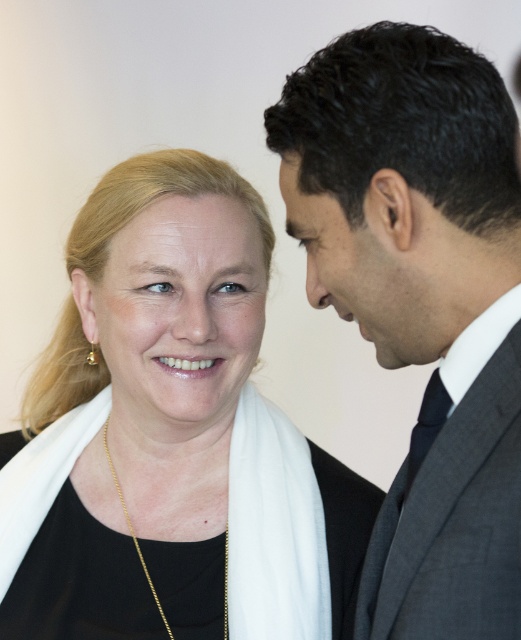
How much distance is there between dark gray suit at right and navy blue silk tie at right?

The distance of dark gray suit at right from navy blue silk tie at right is 12.80 centimeters.

Can you confirm if dark gray suit at right is positioned above navy blue silk tie at right?

Correct, dark gray suit at right is located above navy blue silk tie at right.

Image resolution: width=521 pixels, height=640 pixels. What do you see at coordinates (420, 300) in the screenshot?
I see `dark gray suit at right` at bounding box center [420, 300].

I want to click on dark gray suit at right, so click(x=420, y=300).

Is matte black scarf at left to the left of navy blue silk tie at right from the viewer's perspective?

Yes, matte black scarf at left is to the left of navy blue silk tie at right.

Can you confirm if matte black scarf at left is bigger than navy blue silk tie at right?

Indeed, matte black scarf at left has a larger size compared to navy blue silk tie at right.

What do you see at coordinates (171, 436) in the screenshot? I see `matte black scarf at left` at bounding box center [171, 436].

Image resolution: width=521 pixels, height=640 pixels. I want to click on matte black scarf at left, so click(171, 436).

Who is positioned more to the left, dark gray wool suit at right or navy blue silk tie at right?

Positioned to the left is navy blue silk tie at right.

Between point (417, 573) and point (427, 422), which one is positioned in front?

Positioned in front is point (417, 573).

Image resolution: width=521 pixels, height=640 pixels. In order to click on dark gray wool suit at right in this screenshot , I will do `click(455, 502)`.